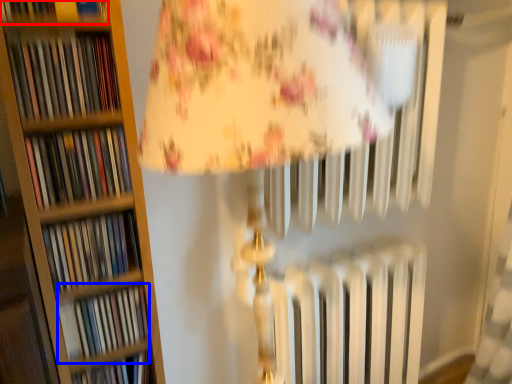
Question: Which object is further to the camera taking this photo, book (highlighted by a red box) or book (highlighted by a blue box)?

Choices:
 (A) book
 (B) book

Answer: (B)